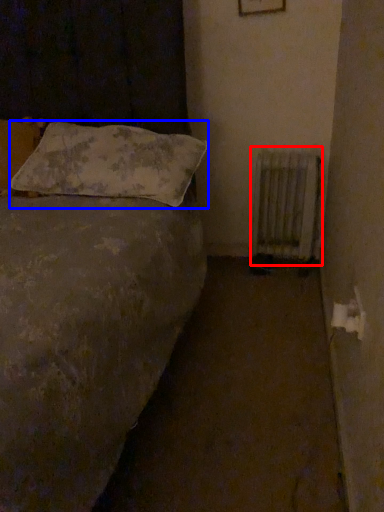
Question: Among these objects, which one is farthest to the camera, radiator (highlighted by a red box) or pillow (highlighted by a blue box)?

Choices:
 (A) radiator
 (B) pillow

Answer: (A)